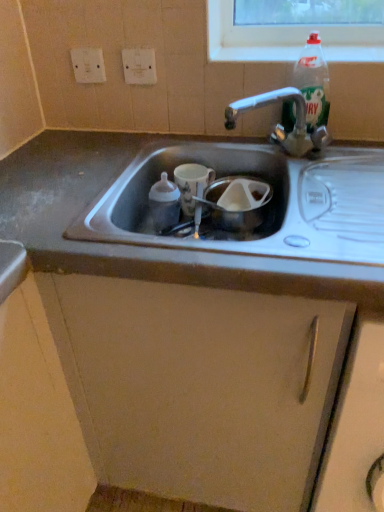
In order to click on free space above clear glass bottle at upper center (from a real-world perspective) in this screenshot , I will do `click(320, 50)`.